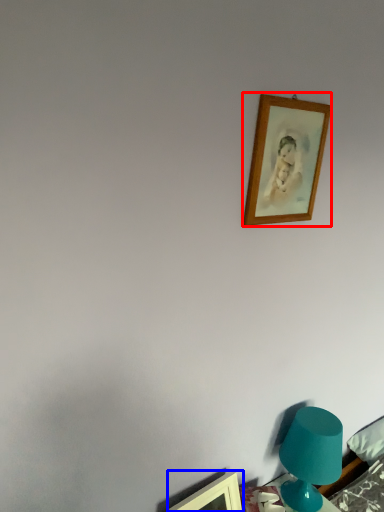
Question: Which point is further to the camera, picture frame (highlighted by a red box) or picture frame (highlighted by a blue box)?

Choices:
 (A) picture frame
 (B) picture frame

Answer: (B)